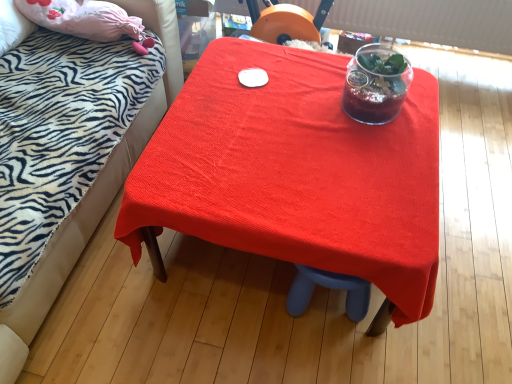
Locate an element on the screen. free space to the left of translucent glass vase at upper center is located at coordinates (308, 102).